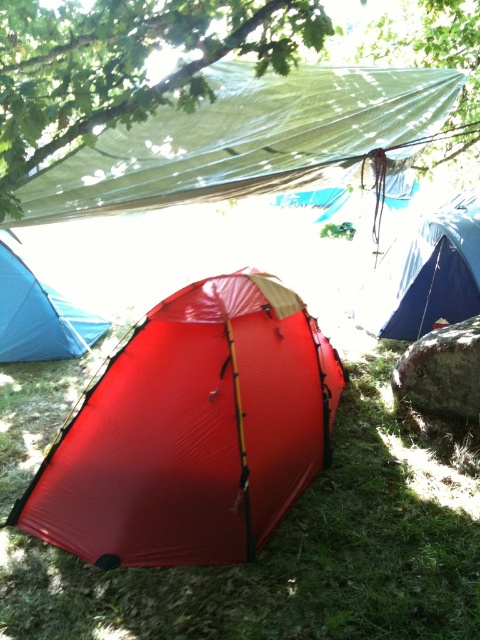
Can you confirm if green matte tarp at upper center is shorter than matte red tent at center?

Incorrect, green matte tarp at upper center's height does not fall short of matte red tent at center's.

Which is in front, point (370, 35) or point (36, 310)?

Point (36, 310) is more forward.

Is point (452, 19) more distant than point (9, 298)?

No, (452, 19) is in front of (9, 298).

Where is `green matte tarp at upper center`? This screenshot has height=640, width=480. green matte tarp at upper center is located at coordinates (435, 60).

Does shiny red tent at center appear on the left side of matte red tent at center?

In fact, shiny red tent at center is to the right of matte red tent at center.

You are a GUI agent. You are given a task and a screenshot of the screen. Output one action in this format:
    pyautogui.click(x=<x>, y=<y>)
    Task: Click on the shiny red tent at center
    The height and width of the screenshot is (640, 480).
    Given the screenshot: What is the action you would take?
    pyautogui.click(x=192, y=432)

Does green tarpaulin at upper center have a larger size compared to blue tarpaulin tent at right?

Yes, green tarpaulin at upper center is bigger than blue tarpaulin tent at right.

Which is in front, point (165, 154) or point (415, 312)?

Point (165, 154) is more forward.

Find the location of a particular element. green tarpaulin at upper center is located at coordinates (247, 140).